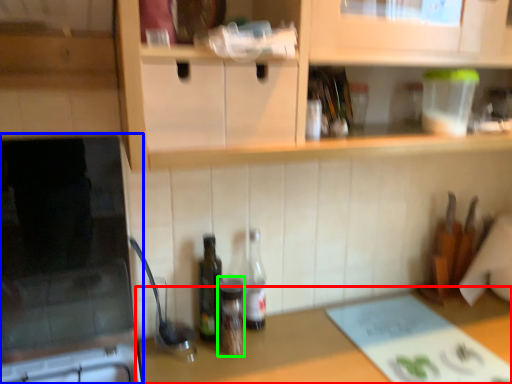
Question: Which object is the closest to the countertop (highlighted by a red box)? Choose among these: appliance (highlighted by a blue box) or bottle (highlighted by a green box).

Choices:
 (A) appliance
 (B) bottle

Answer: (B)